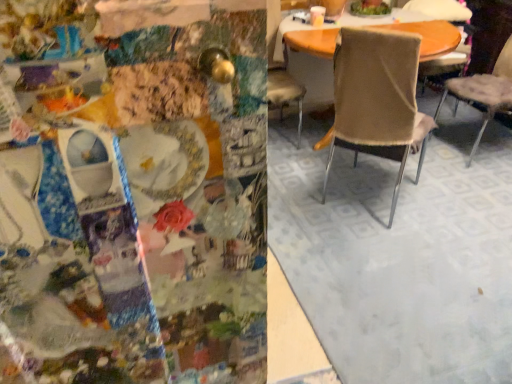
Question: Is beige fabric chair at center, marked as the fourth chair in a right-to-left arrangement, bigger or smaller than beige fabric chair at center, arranged as the third chair when viewed from the right?

Choices:
 (A) small
 (B) big

Answer: (A)

Question: From a real-world perspective, relative to beige fabric chair at center, arranged as the third chair when viewed from the right, is beige fabric chair at center, which is the 1th chair in left-to-right order, vertically above or below?

Choices:
 (A) above
 (B) below

Answer: (A)

Question: Which object is the farthest from the beige fabric chair at center, positioned as the 3th chair in left-to-right order?

Choices:
 (A) beige fabric chair at center, arranged as the third chair when viewed from the right
 (B) beige fabric chair at center, the fourth chair when ordered from left to right
 (C) beige fabric chair at center, marked as the fourth chair in a right-to-left arrangement

Answer: (A)

Question: Which object is the closest to the beige fabric chair at center, positioned as the second chair in right-to-left order?

Choices:
 (A) beige fabric chair at center, placed as the second chair when sorted from left to right
 (B) beige fabric chair at center, marked as the fourth chair in a right-to-left arrangement
 (C) beige fabric chair at center, which is counted as the 1th chair, starting from the right

Answer: (C)